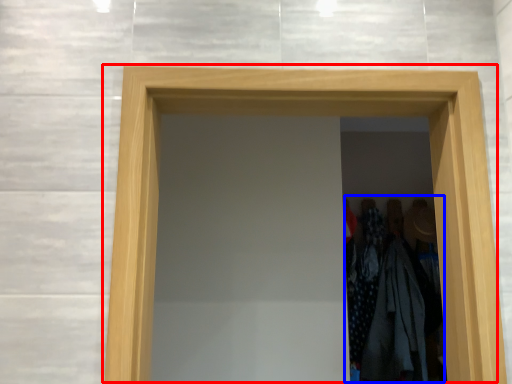
Question: Which object is closer to the camera taking this photo, door (highlighted by a red box) or laundry (highlighted by a blue box)?

Choices:
 (A) door
 (B) laundry

Answer: (A)